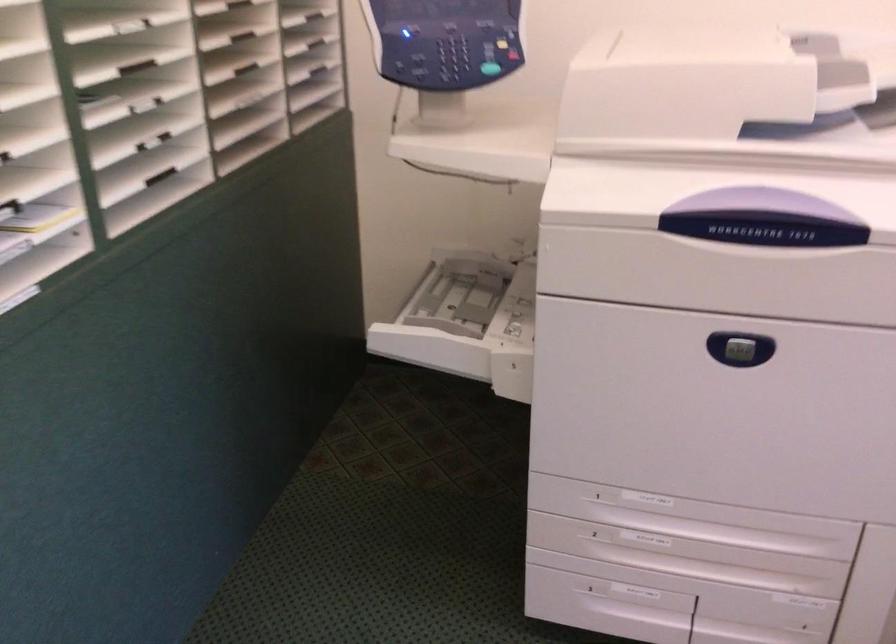
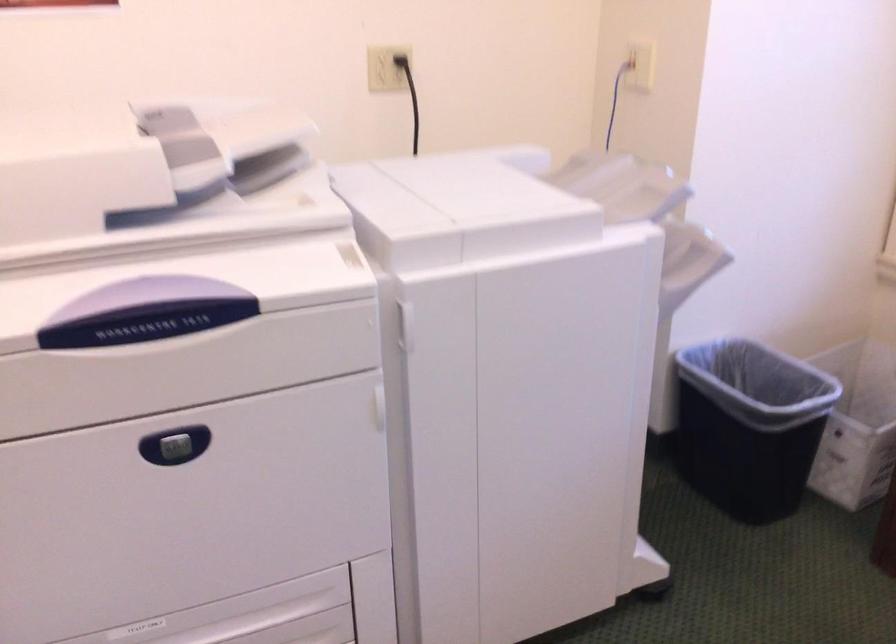
Question: The images are taken continuously from a first-person perspective. In which direction is your viewpoint rotating?

Choices:
 (A) Left
 (B) Right
 (C) Up
 (D) Down

Answer: (B)